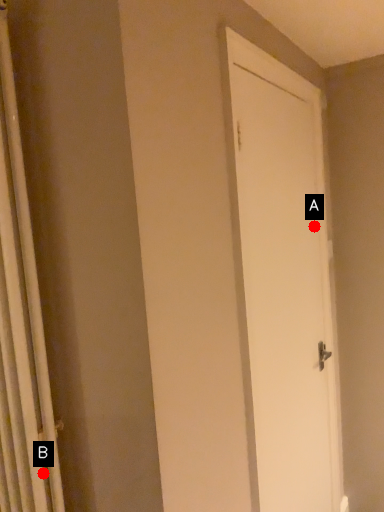
Question: Two points are circled on the image, labeled by A and B beside each circle. Which point is further to the camera?

Choices:
 (A) A is further
 (B) B is further

Answer: (A)